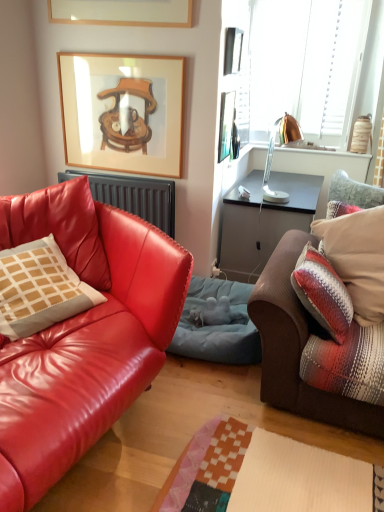
How much space does matte leather couch at left, the first studio couch in the left-to-right sequence, occupy vertically?

matte leather couch at left, the first studio couch in the left-to-right sequence, is 36.49 inches in height.

You are a GUI agent. You are given a task and a screenshot of the screen. Output one action in this format:
    pyautogui.click(x=<x>, y=<y>)
    Task: Click on the blue fabric pet bed at center
    This screenshot has height=512, width=384.
    Given the screenshot: What is the action you would take?
    pyautogui.click(x=217, y=326)

What do you see at coordinates (232, 50) in the screenshot?
I see `metallic silver picture frame at upper center, acting as the 1th picture frame starting from the right` at bounding box center [232, 50].

Describe the element at coordinates (226, 124) in the screenshot. I see `metallic silver picture frame at upper right, positioned as the 2th picture frame in left-to-right order` at that location.

What do you see at coordinates (39, 289) in the screenshot? The width and height of the screenshot is (384, 512). I see `matte beige pillow at left, the 1th pillow positioned from the left` at bounding box center [39, 289].

Locate an element on the screen. The image size is (384, 512). plaid fabric pillow at right, the 2th pillow in the left-to-right sequence is located at coordinates (357, 258).

Where is `matte black radiator at left`? This screenshot has height=512, width=384. matte black radiator at left is located at coordinates (133, 196).

Considering the positions of point (225, 102) and point (288, 345), is point (225, 102) closer or farther from the camera than point (288, 345)?

Point (225, 102) appears to be farther away from the viewer than point (288, 345).

Which object is wider, metallic silver picture frame at upper right, the 2th picture frame in the right-to-left sequence, or plush brown couch at right, placed as the 1th studio couch when sorted from right to left?

plush brown couch at right, placed as the 1th studio couch when sorted from right to left.

Is metallic silver picture frame at upper right, the 2th picture frame in the right-to-left sequence, at the right side of plush brown couch at right, placed as the 2th studio couch when sorted from left to right?

No.

From the image's perspective, which one is positioned higher, metallic silver picture frame at upper right, the 2th picture frame in the right-to-left sequence, or plaid fabric pillow at right, the 2th pillow in the left-to-right sequence?

metallic silver picture frame at upper right, the 2th picture frame in the right-to-left sequence, from the image's perspective.

Is metallic silver picture frame at upper right, positioned as the 2th picture frame in left-to-right order, completely or partially outside of plaid fabric pillow at right, the first pillow positioned from the right?

Yes, metallic silver picture frame at upper right, positioned as the 2th picture frame in left-to-right order, is located beyond the bounds of plaid fabric pillow at right, the first pillow positioned from the right.

From a real-world perspective, who is located higher, metallic silver picture frame at upper right, positioned as the 2th picture frame in left-to-right order, or plaid fabric pillow at right, the first pillow positioned from the right?

metallic silver picture frame at upper right, positioned as the 2th picture frame in left-to-right order, is physically above.

From a real-world perspective, between wooden picture frame at upper center, which ranks as the 1th picture frame in left-to-right order, and plush brown couch at right, placed as the 2th studio couch when sorted from left to right, who is vertically higher?

In real-world perspective, wooden picture frame at upper center, which ranks as the 1th picture frame in left-to-right order, is above.

Is wooden picture frame at upper center, acting as the 3th picture frame starting from the right, beside plush brown couch at right, placed as the 2th studio couch when sorted from left to right?

No, wooden picture frame at upper center, acting as the 3th picture frame starting from the right, is not next to plush brown couch at right, placed as the 2th studio couch when sorted from left to right.

Is wooden picture frame at upper center, acting as the 3th picture frame starting from the right, surrounding plush brown couch at right, placed as the 2th studio couch when sorted from left to right?

No, plush brown couch at right, placed as the 2th studio couch when sorted from left to right, is not a part of wooden picture frame at upper center, acting as the 3th picture frame starting from the right.

Which object is more forward, plush brown couch at right, placed as the 2th studio couch when sorted from left to right, or matte black radiator at left?

Positioned in front is plush brown couch at right, placed as the 2th studio couch when sorted from left to right.

Considering the relative sizes of plush brown couch at right, placed as the 2th studio couch when sorted from left to right, and matte black radiator at left in the image provided, is plush brown couch at right, placed as the 2th studio couch when sorted from left to right, bigger than matte black radiator at left?

Indeed, plush brown couch at right, placed as the 2th studio couch when sorted from left to right, has a larger size compared to matte black radiator at left.

Measure the distance between plush brown couch at right, placed as the 2th studio couch when sorted from left to right, and matte black radiator at left.

They are 1.13 meters apart.

Looking at the image, does blue fabric pet bed at center seem bigger or smaller compared to plush brown couch at right, placed as the 1th studio couch when sorted from right to left?

Clearly, blue fabric pet bed at center is smaller in size than plush brown couch at right, placed as the 1th studio couch when sorted from right to left.

From a real-world perspective, is blue fabric pet bed at center on top of plush brown couch at right, placed as the 2th studio couch when sorted from left to right?

No, from a real-world perspective, blue fabric pet bed at center is not over plush brown couch at right, placed as the 2th studio couch when sorted from left to right

Is blue fabric pet bed at center at the left side of plush brown couch at right, placed as the 2th studio couch when sorted from left to right?

Correct, you'll find blue fabric pet bed at center to the left of plush brown couch at right, placed as the 2th studio couch when sorted from left to right.

Is blue fabric pet bed at center thinner than plush brown couch at right, placed as the 1th studio couch when sorted from right to left?

In fact, blue fabric pet bed at center might be wider than plush brown couch at right, placed as the 1th studio couch when sorted from right to left.

From the image's perspective, who appears lower, matte beige pillow at left, the 1th pillow positioned from the left, or matte black radiator at left?

From the image's view, matte beige pillow at left, the 1th pillow positioned from the left, is below.

Relative to matte black radiator at left, is matte beige pillow at left, the 1th pillow positioned from the left, in front or behind?

Clearly, matte beige pillow at left, the 1th pillow positioned from the left, is in front of matte black radiator at left.

From a real-world perspective, does matte beige pillow at left, the 1th pillow positioned from the left, stand above matte black radiator at left?

No, from a real-world perspective, matte beige pillow at left, the 1th pillow positioned from the left, is not over matte black radiator at left

Considering the positions of point (68, 268) and point (92, 173), is point (68, 268) closer or farther from the camera than point (92, 173)?

Point (68, 268) is positioned closer to the camera compared to point (92, 173).

Between matte beige pillow at left, which appears as the second pillow when viewed from the right, and blue fabric pet bed at center, which one appears on the right side from the viewer's perspective?

From the viewer's perspective, blue fabric pet bed at center appears more on the right side.

Considering the sizes of objects matte beige pillow at left, which appears as the second pillow when viewed from the right, and blue fabric pet bed at center in the image provided, who is taller, matte beige pillow at left, which appears as the second pillow when viewed from the right, or blue fabric pet bed at center?

matte beige pillow at left, which appears as the second pillow when viewed from the right.

How many degrees apart are the facing directions of matte beige pillow at left, which appears as the second pillow when viewed from the right, and blue fabric pet bed at center?

55.8 degrees.

From a real-world perspective, starting from the metallic silver picture frame at upper right, positioned as the 2th picture frame in left-to-right order, which studio couch is the 1st one below it? Please provide its 2D coordinates.

[(296, 345)]

Which picture frame is the 3rd one when counting from the back of the plaid fabric pillow at right, the 2th pillow in the left-to-right sequence? Please provide its 2D coordinates.

[(226, 124)]

Consider the image. When comparing their distances from wooden picture frame at upper center, acting as the 3th picture frame starting from the right, does matte leather couch at left, the 2th studio couch positioned from the right, or metallic silver picture frame at upper right, the 2th picture frame in the right-to-left sequence, seem further?

matte leather couch at left, the 2th studio couch positioned from the right.

Estimate the real-world distances between objects in this image. Which object is closer to metallic silver picture frame at upper right, positioned as the 2th picture frame in left-to-right order, wooden picture frame at upper center, which ranks as the 1th picture frame in left-to-right order, or matte beige pillow at left, the 1th pillow positioned from the left?

Among the two, wooden picture frame at upper center, which ranks as the 1th picture frame in left-to-right order, is located nearer to metallic silver picture frame at upper right, positioned as the 2th picture frame in left-to-right order.

Which object lies further to the anchor point metallic silver picture frame at upper right, the 2th picture frame in the right-to-left sequence, matte leather couch at left, the first studio couch in the left-to-right sequence, or blue fabric pet bed at center?

matte leather couch at left, the first studio couch in the left-to-right sequence, lies further to metallic silver picture frame at upper right, the 2th picture frame in the right-to-left sequence, than the other object.

Which object lies further to the anchor point wooden picture frame at upper center, acting as the 3th picture frame starting from the right, blue fabric pet bed at center or matte leather couch at left, the first studio couch in the left-to-right sequence?

blue fabric pet bed at center.

Based on their spatial positions, is matte black radiator at left or blue fabric pet bed at center closer to matte leather couch at left, the 2th studio couch positioned from the right?

blue fabric pet bed at center is positioned closer to the anchor matte leather couch at left, the 2th studio couch positioned from the right.

Considering their positions, is plush brown couch at right, placed as the 2th studio couch when sorted from left to right, positioned further to matte leather couch at left, the 2th studio couch positioned from the right, than matte beige pillow at left, which appears as the second pillow when viewed from the right?

plush brown couch at right, placed as the 2th studio couch when sorted from left to right, is positioned further to the anchor matte leather couch at left, the 2th studio couch positioned from the right.

Which object lies nearer to the anchor point matte beige pillow at left, the 1th pillow positioned from the left, plush brown couch at right, placed as the 2th studio couch when sorted from left to right, or wooden picture frame at upper center, which ranks as the 1th picture frame in left-to-right order?

plush brown couch at right, placed as the 2th studio couch when sorted from left to right, is positioned closer to the anchor matte beige pillow at left, the 1th pillow positioned from the left.

From the image, which object appears to be nearer to matte beige pillow at left, the 1th pillow positioned from the left, metallic silver picture frame at upper right, positioned as the 2th picture frame in left-to-right order, or plush brown couch at right, placed as the 1th studio couch when sorted from right to left?

plush brown couch at right, placed as the 1th studio couch when sorted from right to left.

Locate an element on the screen. This screenshot has width=384, height=512. studio couch located between matte leather couch at left, the 2th studio couch positioned from the right, and matte black radiator at left in the depth direction is located at coordinates (296, 345).

Where is `studio couch between matte black radiator at left and copper metallic lamp at upper right in the horizontal direction`? This screenshot has width=384, height=512. studio couch between matte black radiator at left and copper metallic lamp at upper right in the horizontal direction is located at coordinates (296, 345).

Find the location of a particular element. picture frame that lies between wooden picture frame at upper center, acting as the 3th picture frame starting from the right, and plush brown couch at right, placed as the 1th studio couch when sorted from right to left, from top to bottom is located at coordinates (226, 124).

The width and height of the screenshot is (384, 512). I want to click on radiator that lies between metallic silver picture frame at upper center, marked as the third picture frame in a left-to-right arrangement, and blue fabric pet bed at center from top to bottom, so click(133, 196).